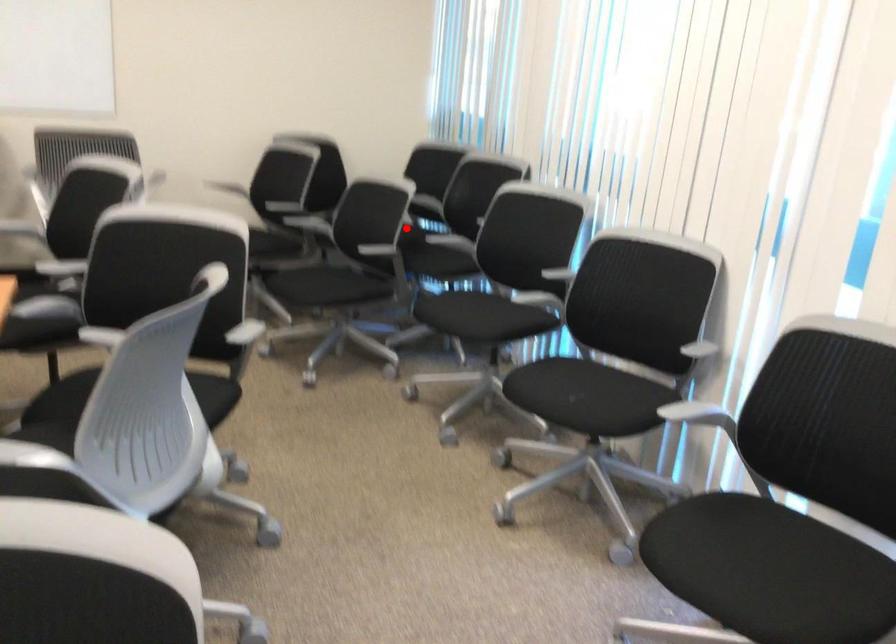
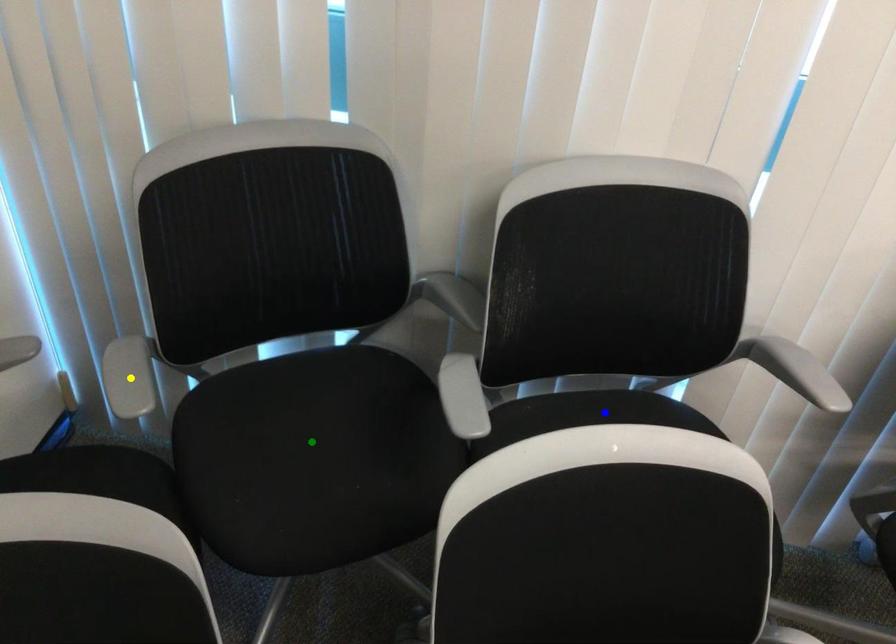
Question: I am providing you with two images of the same scene from different viewpoints. A red point is marked on the first image. You are given multiple points on the second image. In image 2, which mark is for the same physical point as the one in image 1?

Choices:
 (A) yellow point
 (B) green point
 (C) blue point

Answer: (B)